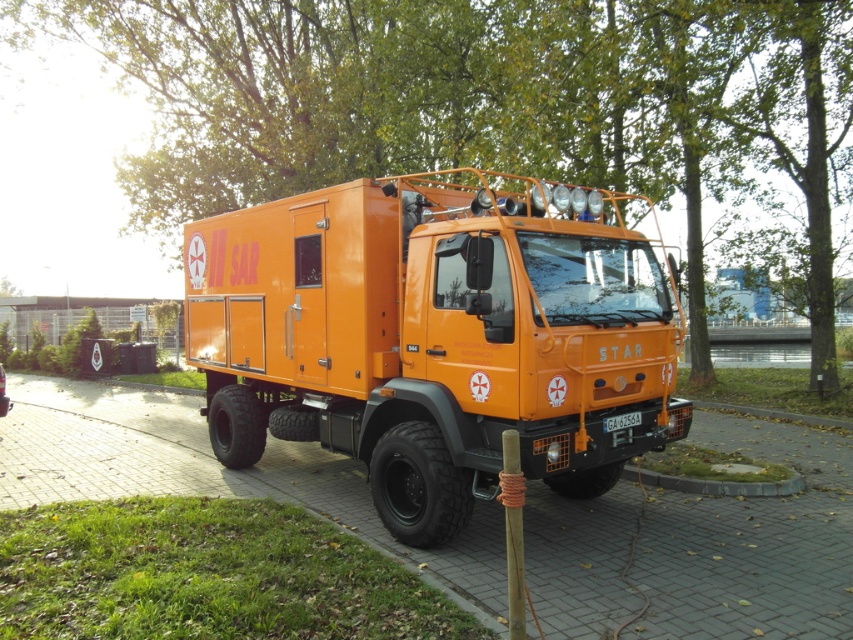
Can you confirm if green leafy tree at upper center is positioned to the right of orange matte truck at center?

Incorrect, green leafy tree at upper center is not on the right side of orange matte truck at center.

Who is more distant from viewer, (242, 83) or (523, 230)?

The point (242, 83) is behind.

I want to click on green leafy tree at upper center, so click(x=480, y=100).

Which of these two, brown wood pole at center or black plastic license plate at center, stands shorter?

Standing shorter between the two is black plastic license plate at center.

Does brown wood pole at center have a larger size compared to black plastic license plate at center?

Correct, brown wood pole at center is larger in size than black plastic license plate at center.

Is point (521, 500) less distant than point (625, 416)?

Yes, point (521, 500) is in front of point (625, 416).

Where is `brown wood pole at center`? This screenshot has width=853, height=640. brown wood pole at center is located at coordinates (514, 531).

Can you confirm if green leafy tree at upper center is positioned above orange rubber pavement at center?

Indeed, green leafy tree at upper center is positioned over orange rubber pavement at center.

Where is `green leafy tree at upper center`? This screenshot has width=853, height=640. green leafy tree at upper center is located at coordinates (480, 100).

Is point (846, 4) less distant than point (618, 492)?

No, (846, 4) is further to viewer.

Locate an element on the screen. Image resolution: width=853 pixels, height=640 pixels. green leafy tree at upper center is located at coordinates (480, 100).